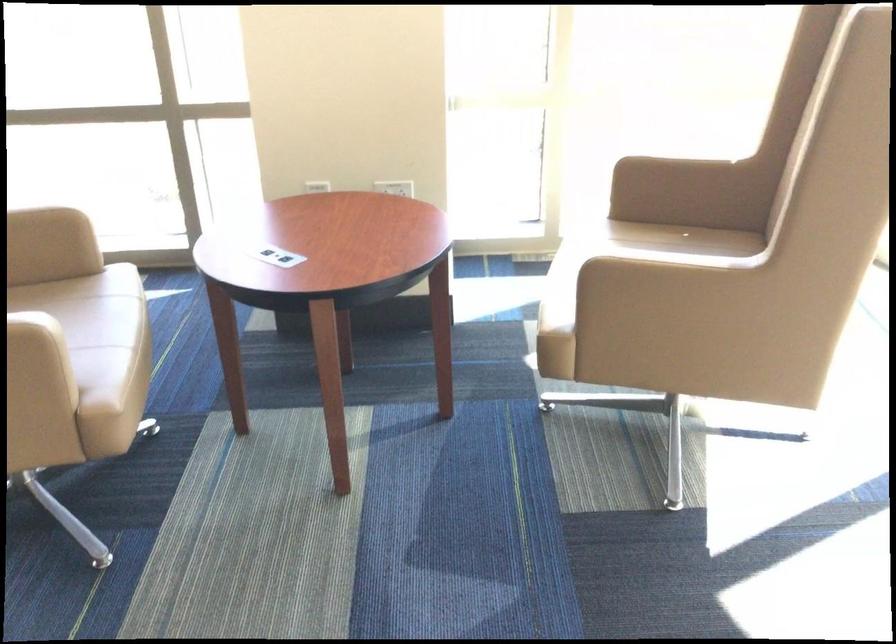
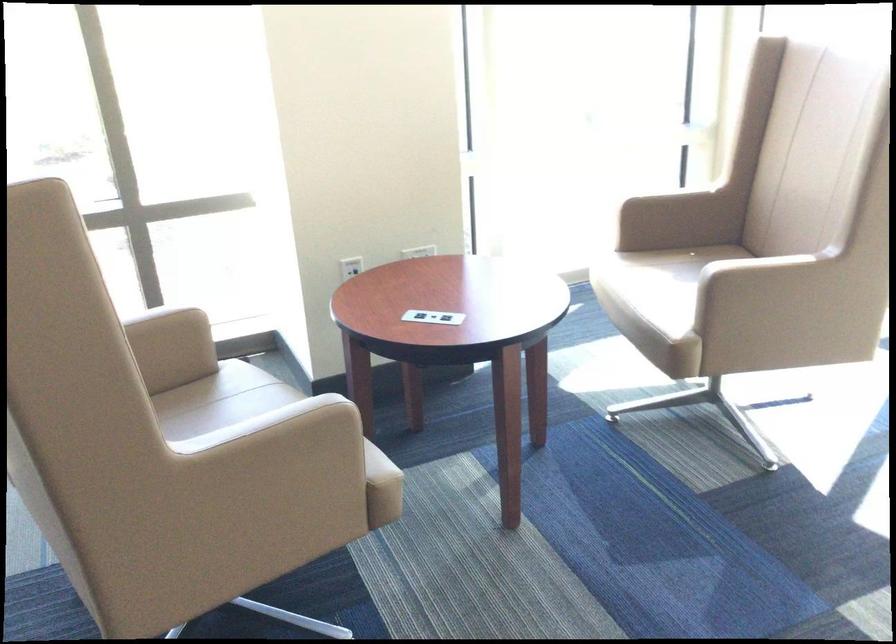
In the second image, find the point that corresponds to (85,286) in the first image.

(211, 389)